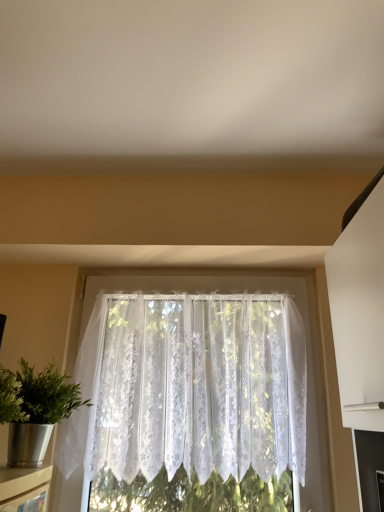
Find the location of a particular element. metallic silver houseplant at left is located at coordinates (35, 409).

The image size is (384, 512). What do you see at coordinates (35, 409) in the screenshot? I see `metallic silver houseplant at left` at bounding box center [35, 409].

Image resolution: width=384 pixels, height=512 pixels. Identify the location of metallic silver shelf at lower left. (24, 487).

Is metallic silver shelf at lower left oriented away from metallic silver houseplant at left?

No, metallic silver shelf at lower left is not facing the opposite direction of metallic silver houseplant at left.

Considering the sizes of objects metallic silver shelf at lower left and metallic silver houseplant at left in the image provided, who is shorter, metallic silver shelf at lower left or metallic silver houseplant at left?

With less height is metallic silver shelf at lower left.

Is metallic silver shelf at lower left far from metallic silver houseplant at left?

They are positioned close to each other.

From a real-world perspective, is metallic silver shelf at lower left above or below metallic silver houseplant at left?

In terms of real-world spatial position, metallic silver shelf at lower left is below metallic silver houseplant at left.

Is there a large distance between metallic silver shelf at lower left and white lace curtain at center?

They are positioned close to each other.

Based on the photo, does metallic silver shelf at lower left appear on the right side of white lace curtain at center?

Incorrect, metallic silver shelf at lower left is not on the right side of white lace curtain at center.

Looking at their sizes, would you say metallic silver shelf at lower left is wider or thinner than white lace curtain at center?

In the image, metallic silver shelf at lower left appears to be more narrow than white lace curtain at center.

From the image's perspective, is metallic silver shelf at lower left below white lace curtain at center?

Yes.

Looking at this image, which of these two, metallic silver houseplant at left or white lace curtain at center, is wider?

metallic silver houseplant at left is wider.

Is metallic silver houseplant at left beside white lace curtain at center?

metallic silver houseplant at left and white lace curtain at center are not in contact.

Is metallic silver houseplant at left taller or shorter than white lace curtain at center?

metallic silver houseplant at left is shorter than white lace curtain at center.

How much distance is there between metallic silver houseplant at left and white lace curtain at center?

A distance of 16.59 inches exists between metallic silver houseplant at left and white lace curtain at center.

Is metallic silver houseplant at left facing towards metallic silver shelf at lower left?

No, metallic silver houseplant at left is not oriented towards metallic silver shelf at lower left.

Is metallic silver houseplant at left taller than metallic silver shelf at lower left?

Yes, metallic silver houseplant at left is taller than metallic silver shelf at lower left.

You are a GUI agent. You are given a task and a screenshot of the screen. Output one action in this format:
    pyautogui.click(x=<x>, y=<y>)
    Task: Click on the shelf on the right of metallic silver houseplant at left
    
    Given the screenshot: What is the action you would take?
    pyautogui.click(x=24, y=487)

What's the angular difference between metallic silver houseplant at left and metallic silver shelf at lower left's facing directions?

3.96 degrees.

Considering the points (90, 433) and (17, 404), which point is behind, point (90, 433) or point (17, 404)?

Positioned behind is point (90, 433).

From a real-world perspective, does white lace curtain at center stand above metallic silver houseplant at left?

Yes, from a real-world perspective, white lace curtain at center is over metallic silver houseplant at left

In the scene shown: Considering the sizes of objects white lace curtain at center and metallic silver houseplant at left in the image provided, who is thinner, white lace curtain at center or metallic silver houseplant at left?

white lace curtain at center.

Is the position of white lace curtain at center more distant than that of metallic silver houseplant at left?

Yes, it is behind metallic silver houseplant at left.

Is white lace curtain at center to the left of metallic silver shelf at lower left from the viewer's perspective?

No, white lace curtain at center is not to the left of metallic silver shelf at lower left.

Is white lace curtain at center shorter than metallic silver shelf at lower left?

No.

Which object is further away from the camera, white lace curtain at center or metallic silver shelf at lower left?

Positioned behind is white lace curtain at center.

The width and height of the screenshot is (384, 512). I want to click on shelf lying in front of the metallic silver houseplant at left, so click(24, 487).

You are a GUI agent. You are given a task and a screenshot of the screen. Output one action in this format:
    pyautogui.click(x=<x>, y=<y>)
    Task: Click on the window above the metallic silver shelf at lower left (from the image's perspective)
    This screenshot has height=512, width=384.
    Given the screenshot: What is the action you would take?
    pyautogui.click(x=189, y=387)

From the image, which object appears to be farther from metallic silver shelf at lower left, metallic silver houseplant at left or white lace curtain at center?

Among the two, white lace curtain at center is located further to metallic silver shelf at lower left.

Considering their positions, is metallic silver shelf at lower left positioned further to metallic silver houseplant at left than white lace curtain at center?

white lace curtain at center.

Based on their spatial positions, is white lace curtain at center or metallic silver houseplant at left closer to metallic silver shelf at lower left?

The object closer to metallic silver shelf at lower left is metallic silver houseplant at left.

Based on the photo, estimate the real-world distances between objects in this image. Which object is further from white lace curtain at center, metallic silver shelf at lower left or metallic silver houseplant at left?

metallic silver shelf at lower left is further to white lace curtain at center.

Looking at the image, which one is located closer to metallic silver houseplant at left, white lace curtain at center or metallic silver shelf at lower left?

Based on the image, metallic silver shelf at lower left appears to be nearer to metallic silver houseplant at left.

Based on their spatial positions, is metallic silver houseplant at left or metallic silver shelf at lower left further from white lace curtain at center?

metallic silver shelf at lower left is positioned further to the anchor white lace curtain at center.

Identify the location of houseplant positioned between metallic silver shelf at lower left and white lace curtain at center from near to far. This screenshot has height=512, width=384. (35, 409).